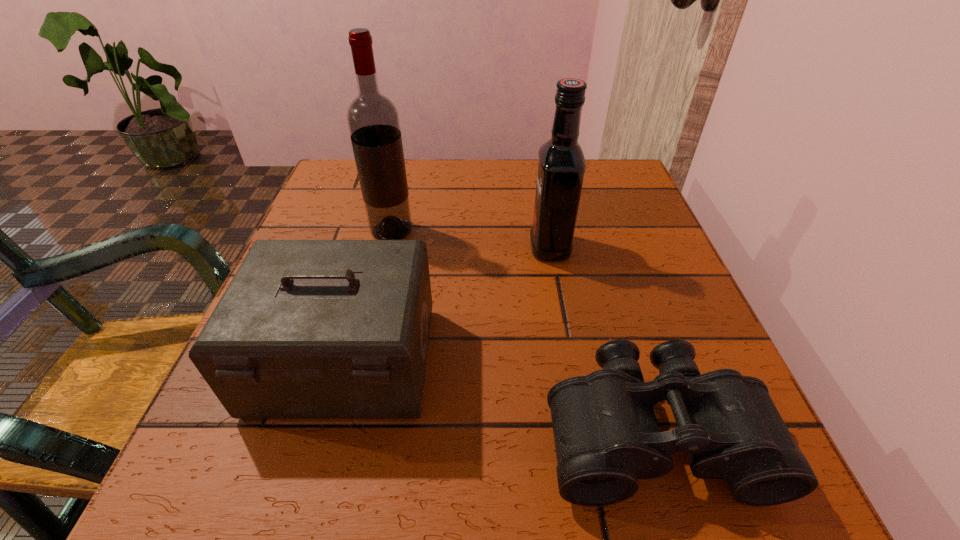
You are a GUI agent. You are given a task and a screenshot of the screen. Output one action in this format:
    pyautogui.click(x=<x>, y=<y>)
    Task: Click on the free location at the far right corner of the desktop
    This screenshot has width=960, height=540.
    Given the screenshot: What is the action you would take?
    pyautogui.click(x=633, y=177)

Image resolution: width=960 pixels, height=540 pixels. In the image, there is a desktop. In order to click on vacant space at the near right corner in this screenshot , I will do `click(712, 487)`.

The image size is (960, 540). Find the location of `free point between the second tallest object and the first-aid kit`. free point between the second tallest object and the first-aid kit is located at coordinates (447, 304).

The height and width of the screenshot is (540, 960). What are the coordinates of `unoccupied position between the shortest object and the first-aid kit` in the screenshot? It's located at (499, 397).

Locate an element on the screen. free space that is in between the second shortest object and the shortest object is located at coordinates (499, 397).

The width and height of the screenshot is (960, 540). I want to click on vacant point located between the tallest object and the third shortest object, so click(470, 239).

The height and width of the screenshot is (540, 960). What are the coordinates of `unoccupied position between the liquor and the binoculars` in the screenshot? It's located at (602, 340).

The image size is (960, 540). Identify the location of free area in between the third shortest object and the first-aid kit. (447, 304).

This screenshot has height=540, width=960. In order to click on free area in between the shortest object and the first-aid kit in this screenshot , I will do `click(499, 397)`.

Where is `object that is the closest one to the tallest object`? object that is the closest one to the tallest object is located at coordinates (307, 329).